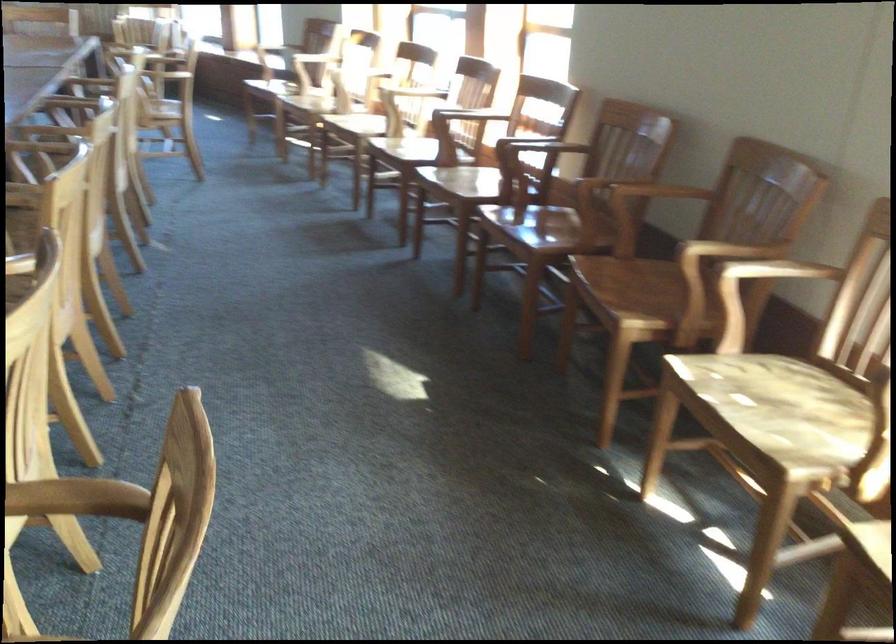
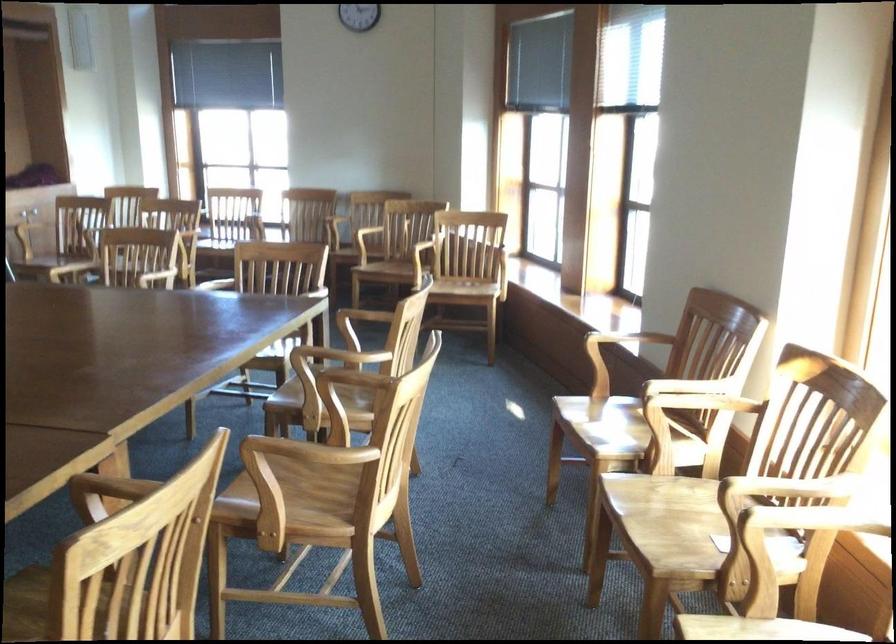
Find the pixel in the second image that matches point 316,108 in the first image.

(665, 526)